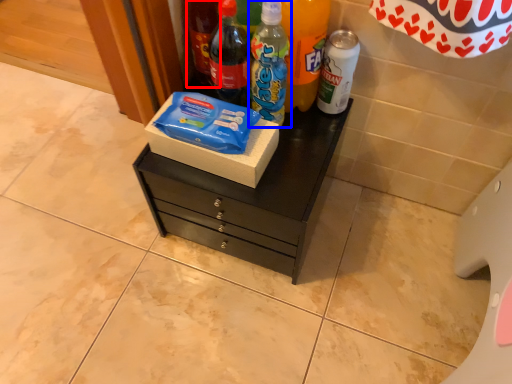
Question: Among these objects, which one is farthest to the camera, bottle (highlighted by a red box) or bottle (highlighted by a blue box)?

Choices:
 (A) bottle
 (B) bottle

Answer: (A)